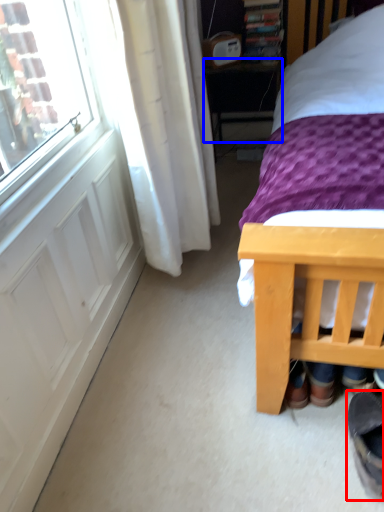
Question: Among these objects, which one is farthest to the camera, footwear (highlighted by a red box) or table (highlighted by a blue box)?

Choices:
 (A) footwear
 (B) table

Answer: (B)